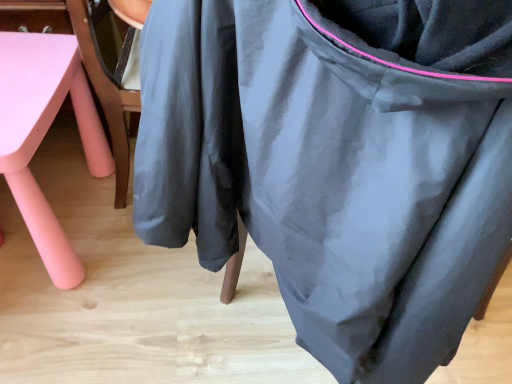
At what (x,y) coordinates should I click in order to perform the action: click on matte black bean bag chair at center. Please return your answer as a coordinate pair (x, y). The height and width of the screenshot is (384, 512). Looking at the image, I should click on (337, 162).

Describe the element at coordinates (337, 162) in the screenshot. I see `matte black bean bag chair at center` at that location.

What do you see at coordinates (45, 134) in the screenshot?
I see `matte pink table at lower left` at bounding box center [45, 134].

Locate an element on the screen. matte pink table at lower left is located at coordinates (45, 134).

Identify the location of matte black bean bag chair at center. (337, 162).

Between matte black bean bag chair at center and matte pink table at lower left, which one appears on the right side from the viewer's perspective?

From the viewer's perspective, matte black bean bag chair at center appears more on the right side.

Based on the photo, is the depth of matte black bean bag chair at center greater than that of matte pink table at lower left?

No, it is in front of matte pink table at lower left.

Does point (376, 187) come farther from viewer compared to point (25, 175)?

No, it is in front of (25, 175).

From the image's perspective, would you say matte black bean bag chair at center is shown under matte pink table at lower left?

Indeed, from the image's perspective, matte black bean bag chair at center is shown beneath matte pink table at lower left.

From a real-world perspective, relative to matte pink table at lower left, is matte black bean bag chair at center vertically above or below?

matte black bean bag chair at center is above matte pink table at lower left.

In terms of width, does matte black bean bag chair at center look wider or thinner when compared to matte pink table at lower left?

In the image, matte black bean bag chair at center appears to be wider than matte pink table at lower left.

Can you confirm if matte black bean bag chair at center is taller than matte pink table at lower left?

Correct, matte black bean bag chair at center is much taller as matte pink table at lower left.

Can you confirm if matte black bean bag chair at center is bigger than matte pink table at lower left?

Indeed, matte black bean bag chair at center has a larger size compared to matte pink table at lower left.

Would you say matte black bean bag chair at center is outside matte pink table at lower left?

Yes, matte black bean bag chair at center is not within matte pink table at lower left.

Is matte black bean bag chair at center not close to matte pink table at lower left?

No, there isn't a large distance between matte black bean bag chair at center and matte pink table at lower left.

Is matte pink table at lower left at the back of matte black bean bag chair at center?

matte black bean bag chair at center is not turned away from matte pink table at lower left.

At what (x,y) coordinates should I click in order to perform the action: click on furniture that is on the left side of matte black bean bag chair at center. Please return your answer as a coordinate pair (x, y). This screenshot has height=384, width=512. Looking at the image, I should click on (45, 134).

Which is more to the left, matte pink table at lower left or matte black bean bag chair at center?

matte pink table at lower left.

Which object is further away from the camera taking this photo, matte pink table at lower left or matte black bean bag chair at center?

Positioned behind is matte pink table at lower left.

Considering the points (92, 129) and (176, 196), which point is in front, point (92, 129) or point (176, 196)?

The point (176, 196) is closer.

From the image's perspective, is matte pink table at lower left located above or below matte black bean bag chair at center?

matte pink table at lower left is situated higher than matte black bean bag chair at center in the image.

From a real-world perspective, who is located higher, matte pink table at lower left or matte black bean bag chair at center?

matte black bean bag chair at center is physically above.

Between matte pink table at lower left and matte black bean bag chair at center, which one has larger width?

matte black bean bag chair at center is wider.

Looking at this image, considering the sizes of objects matte pink table at lower left and matte black bean bag chair at center in the image provided, who is shorter, matte pink table at lower left or matte black bean bag chair at center?

matte pink table at lower left.

Between matte pink table at lower left and matte black bean bag chair at center, which one has larger size?

matte black bean bag chair at center is bigger.

Is matte pink table at lower left situated inside matte black bean bag chair at center or outside?

matte pink table at lower left is spatially situated outside matte black bean bag chair at center.

Is matte pink table at lower left directly adjacent to matte black bean bag chair at center?

No, matte pink table at lower left is not next to matte black bean bag chair at center.

Is matte black bean bag chair at center at the back of matte pink table at lower left?

matte pink table at lower left does not have its back to matte black bean bag chair at center.

How different are the orientations of matte pink table at lower left and matte black bean bag chair at center in degrees?

The angle between the facing direction of matte pink table at lower left and the facing direction of matte black bean bag chair at center is 154 degrees.

Locate an element on the screen. bean bag chair above the matte pink table at lower left (from a real-world perspective) is located at coordinates (337, 162).

Find the location of a particular element. Image resolution: width=512 pixels, height=384 pixels. bean bag chair located below the matte pink table at lower left (from the image's perspective) is located at coordinates (337, 162).

This screenshot has height=384, width=512. I want to click on furniture above the matte black bean bag chair at center (from the image's perspective), so click(x=45, y=134).